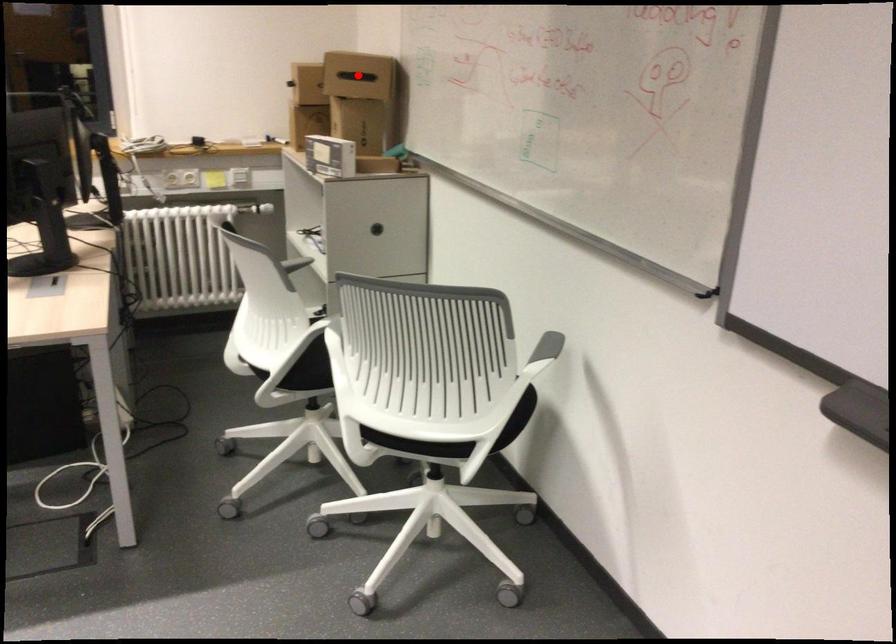
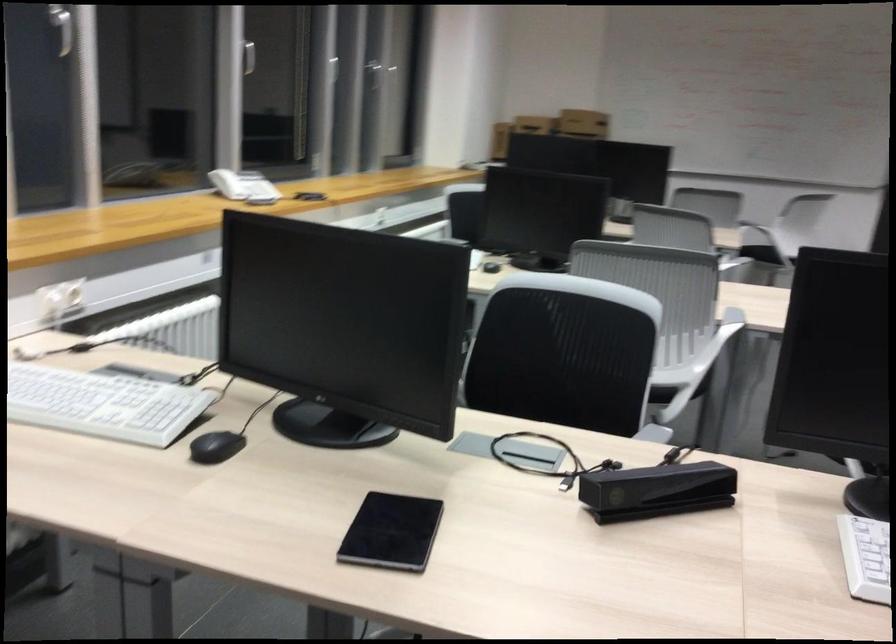
Question: I am providing you with two images of the same scene from different viewpoints. A red point is marked on the first image. Can you still see the location of the red point in image 2?

Choices:
 (A) Yes
 (B) No

Answer: (B)